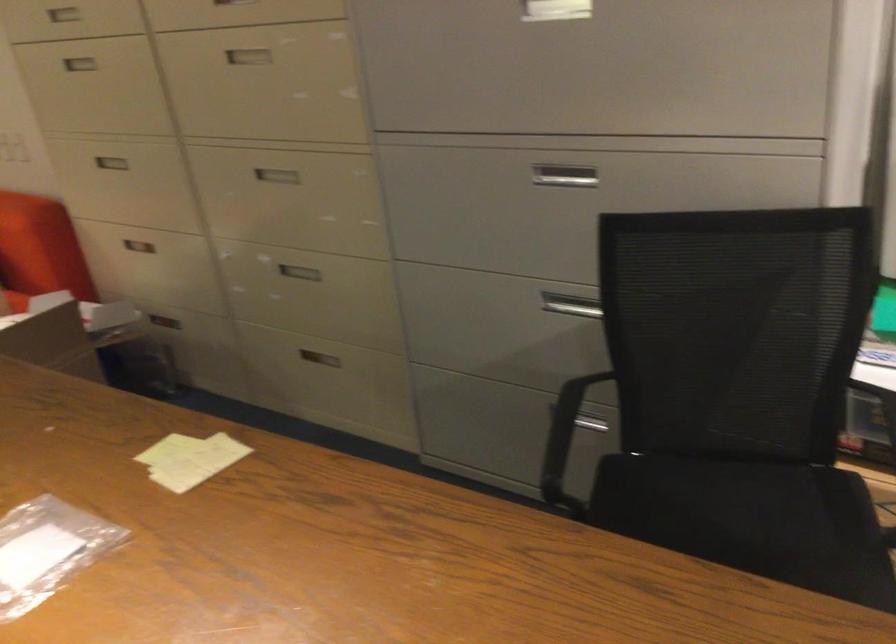
Find the location of a particular element. This screenshot has height=644, width=896. chair armrest is located at coordinates (599, 410).